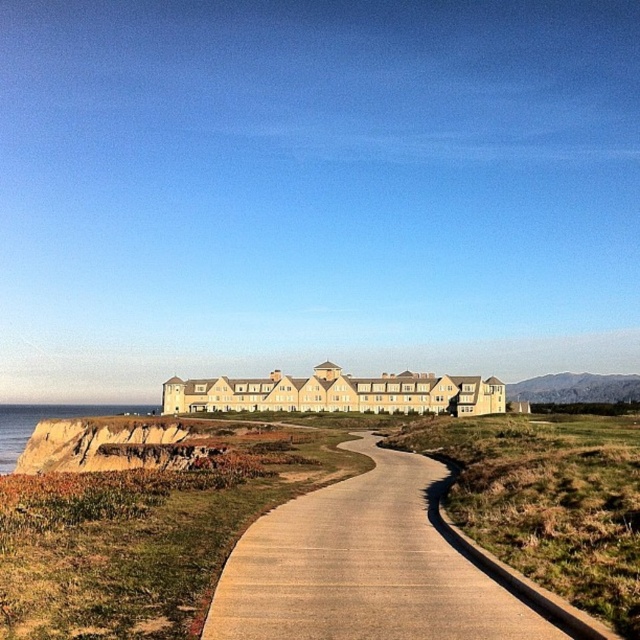
The height and width of the screenshot is (640, 640). I want to click on concrete at center, so click(380, 566).

Which of these two, concrete at center or brown rocky cliff at left, stands shorter?

concrete at center is shorter.

This screenshot has height=640, width=640. I want to click on concrete at center, so click(x=380, y=566).